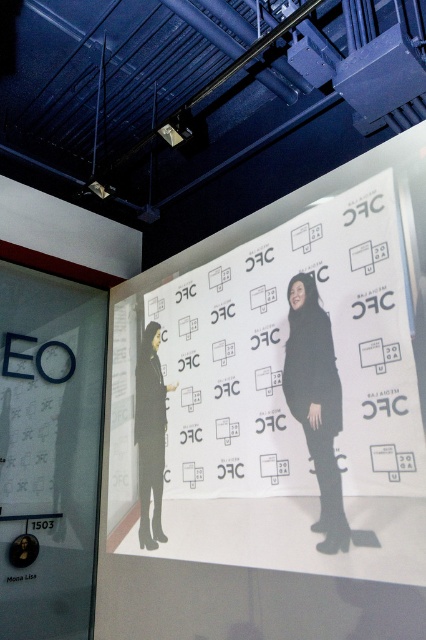
Can you confirm if white paper at center is positioned below black matte coat at center?

Correct, white paper at center is located below black matte coat at center.

Does point (273, 307) come farther from viewer compared to point (317, 381)?

Yes.

Does point (363, 486) lie behind point (330, 401)?

That is False.

At what (x,y) coordinates should I click in order to perform the action: click on white paper at center. Please return your answer as a coordinate pair (x, y). Looking at the image, I should click on (284, 397).

Is white paper at center further to the viewer compared to black matte coat at left?

No, white paper at center is in front of black matte coat at left.

Does white paper at center appear over black matte coat at left?

Correct, white paper at center is located above black matte coat at left.

Who is more forward, (229,429) or (161,403)?

Point (229,429) is more forward.

You are a GUI agent. You are given a task and a screenshot of the screen. Output one action in this format:
    pyautogui.click(x=<x>, y=<y>)
    Task: Click on the white paper at center
    This screenshot has height=640, width=426.
    Given the screenshot: What is the action you would take?
    click(284, 397)

Is black matte coat at center positioned before black matte coat at left?

Yes, black matte coat at center is in front of black matte coat at left.

The width and height of the screenshot is (426, 640). Describe the element at coordinates (316, 403) in the screenshot. I see `black matte coat at center` at that location.

Is point (310, 340) closer to viewer compared to point (152, 321)?

Yes.

Where is `black matte coat at center`? The width and height of the screenshot is (426, 640). black matte coat at center is located at coordinates (316, 403).